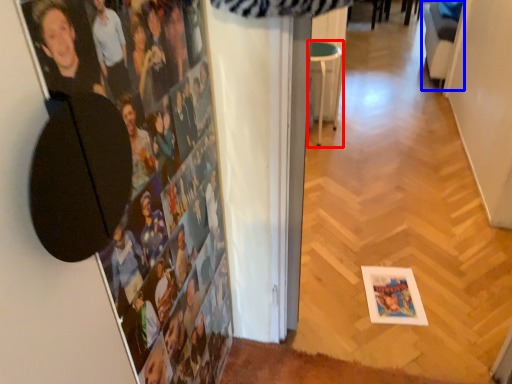
Question: Among these objects, which one is farthest to the camera, furniture (highlighted by a red box) or swivel chair (highlighted by a blue box)?

Choices:
 (A) furniture
 (B) swivel chair

Answer: (B)